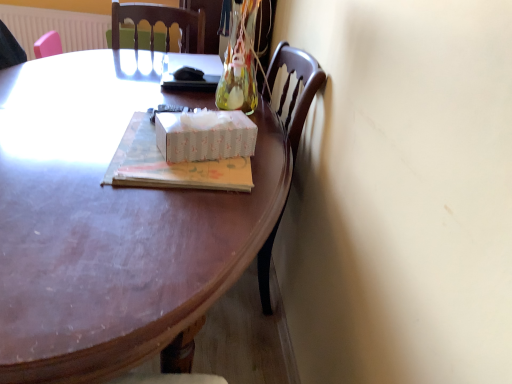
Question: From a real-world perspective, is matte cardboard book at center over white plastic radiator at upper left?

Choices:
 (A) no
 (B) yes

Answer: (B)

Question: Is matte cardboard book at center directly adjacent to white plastic radiator at upper left?

Choices:
 (A) yes
 (B) no

Answer: (B)

Question: Is matte cardboard book at center positioned with its back to white plastic radiator at upper left?

Choices:
 (A) no
 (B) yes

Answer: (A)

Question: Can you confirm if matte cardboard book at center is positioned to the left of white plastic radiator at upper left?

Choices:
 (A) yes
 (B) no

Answer: (B)

Question: Does matte cardboard book at center lie behind white plastic radiator at upper left?

Choices:
 (A) no
 (B) yes

Answer: (A)

Question: Do you think matte cardboard book at center is within white paper tissue box at center, or outside of it?

Choices:
 (A) outside
 (B) inside

Answer: (A)

Question: Is matte cardboard book at center wider or thinner than white paper tissue box at center?

Choices:
 (A) thin
 (B) wide

Answer: (B)

Question: Looking at the image, does matte cardboard book at center seem bigger or smaller compared to white paper tissue box at center?

Choices:
 (A) small
 (B) big

Answer: (B)

Question: From a real-world perspective, is matte cardboard book at center above or below white paper tissue box at center?

Choices:
 (A) above
 (B) below

Answer: (B)

Question: From the image's perspective, relative to white paper tissue box at center, is white plastic radiator at upper left above or below?

Choices:
 (A) below
 (B) above

Answer: (B)

Question: Is white plastic radiator at upper left to the left or to the right of white paper tissue box at center in the image?

Choices:
 (A) right
 (B) left

Answer: (B)

Question: Is white plastic radiator at upper left in front of or behind white paper tissue box at center in the image?

Choices:
 (A) front
 (B) behind

Answer: (B)

Question: Would you say white plastic radiator at upper left is inside or outside white paper tissue box at center?

Choices:
 (A) inside
 (B) outside

Answer: (B)

Question: From the image's perspective, is wooden desk at center positioned above or below white paper tissue box at center?

Choices:
 (A) below
 (B) above

Answer: (A)

Question: Is wooden desk at center to the left or to the right of white paper tissue box at center in the image?

Choices:
 (A) right
 (B) left

Answer: (B)